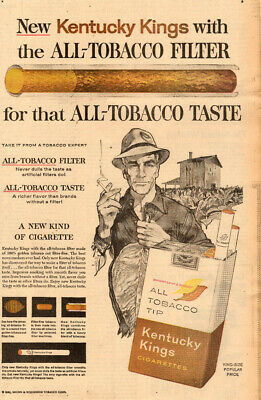
Locate an element on the screen. This screenshot has height=400, width=261. plant is located at coordinates (201, 198).